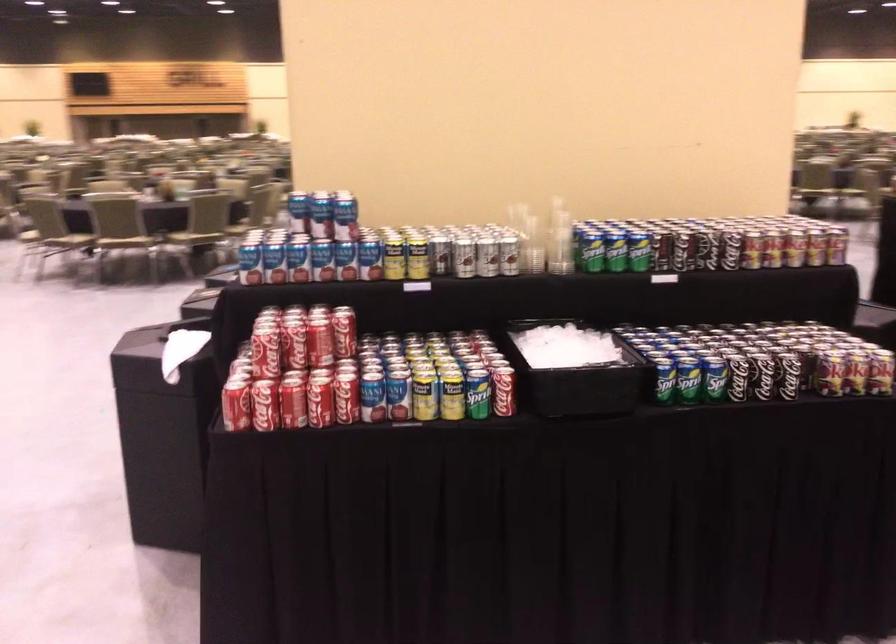
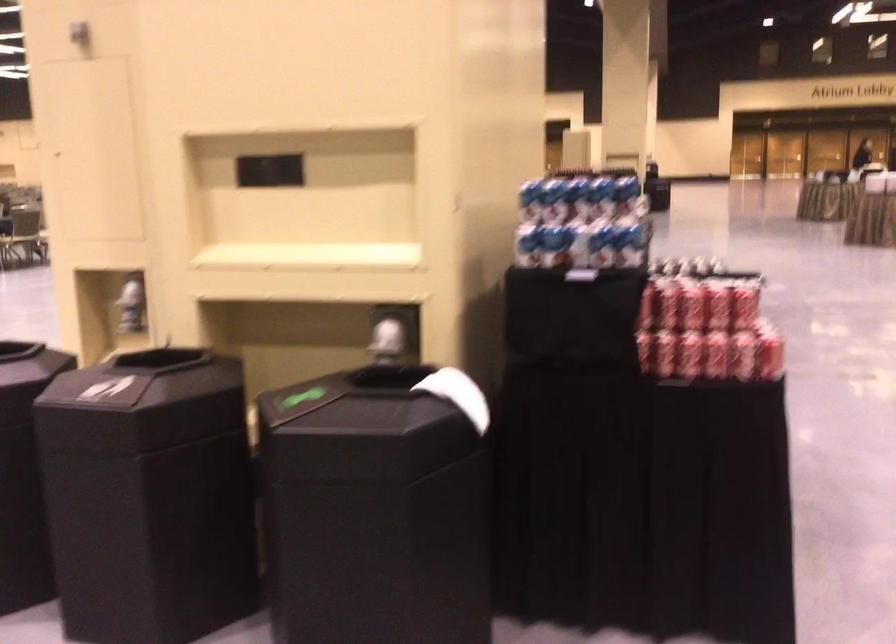
Find the pixel in the second image that matches the point at 228,355 in the first image.

(645, 351)